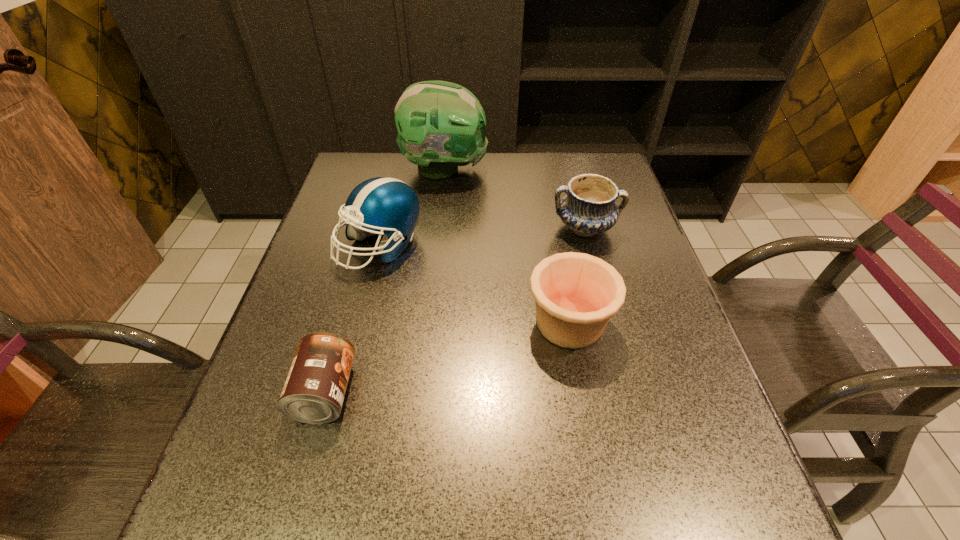
Identify the location of vacant position in the image that satisfies the following two spatial constraints: 1. at the front of the nearer football helmet with the faceguard; 2. on the front label of the nearest object. (344, 393).

The width and height of the screenshot is (960, 540). Find the location of `free space that satisfies the following two spatial constraints: 1. on the visor of the taller football helmet; 2. at the front of the shorter football helmet with the faceguard`. free space that satisfies the following two spatial constraints: 1. on the visor of the taller football helmet; 2. at the front of the shorter football helmet with the faceguard is located at coordinates (437, 246).

This screenshot has height=540, width=960. In order to click on free space that satisfies the following two spatial constraints: 1. at the front of the nearer pottery with the faceguard; 2. on the left side of the shorter football helmet in this screenshot , I will do `click(361, 322)`.

I want to click on vacant region that satisfies the following two spatial constraints: 1. on the back side of the farther pottery; 2. on the visor of the farthest object, so click(569, 169).

Locate an element on the screen. The image size is (960, 540). vacant space that satisfies the following two spatial constraints: 1. on the front side of the nearer pottery; 2. on the front label of the shortest object is located at coordinates (582, 393).

You are a GUI agent. You are given a task and a screenshot of the screen. Output one action in this format:
    pyautogui.click(x=<x>, y=<y>)
    Task: Click on the blank area in the image that satisfies the following two spatial constraints: 1. on the visor of the farthest object; 2. at the front of the second tallest object with the faceguard
    This screenshot has height=540, width=960.
    Given the screenshot: What is the action you would take?
    pyautogui.click(x=437, y=246)

At what (x,y) coordinates should I click in order to perform the action: click on vacant space that satisfies the following two spatial constraints: 1. at the front of the fourth shortest object with the faceguard; 2. on the front label of the can. Please return your answer as a coordinate pair (x, y). The width and height of the screenshot is (960, 540). Looking at the image, I should click on (344, 393).

Find the location of `free space that satisfies the following two spatial constraints: 1. on the back side of the fourth farthest object; 2. on the right side of the farther pottery`. free space that satisfies the following two spatial constraints: 1. on the back side of the fourth farthest object; 2. on the right side of the farther pottery is located at coordinates (552, 228).

Locate an element on the screen. The image size is (960, 540). free location that satisfies the following two spatial constraints: 1. on the front side of the farther pottery; 2. on the front label of the nearest object is located at coordinates (629, 393).